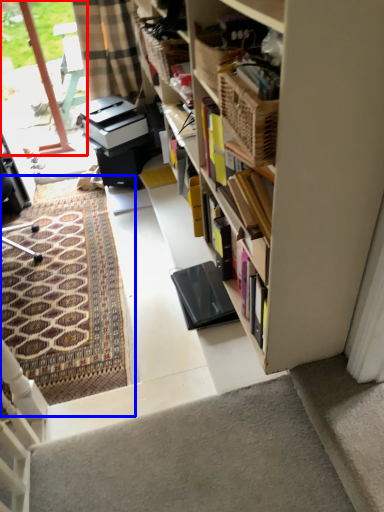
Question: Which object appears farthest to the camera in this image, glass door (highlighted by a red box) or doormat (highlighted by a blue box)?

Choices:
 (A) glass door
 (B) doormat

Answer: (A)